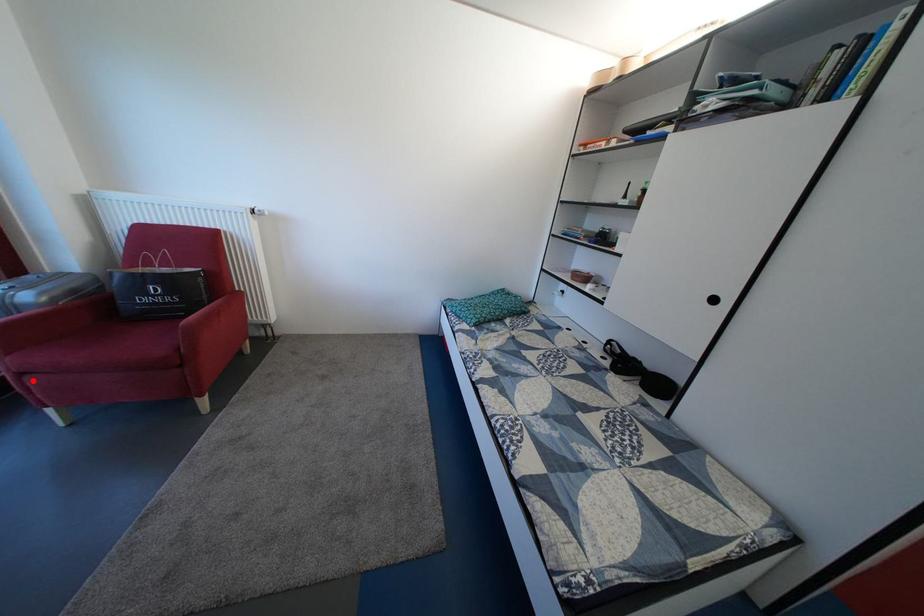
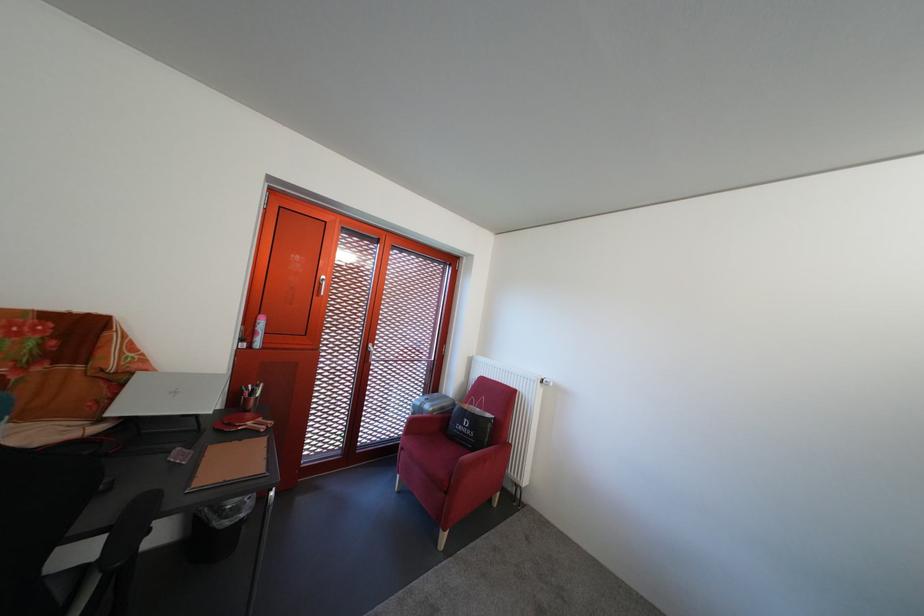
Where in the second image is the point corresponding to the highlighted location from the first image?

(412, 456)